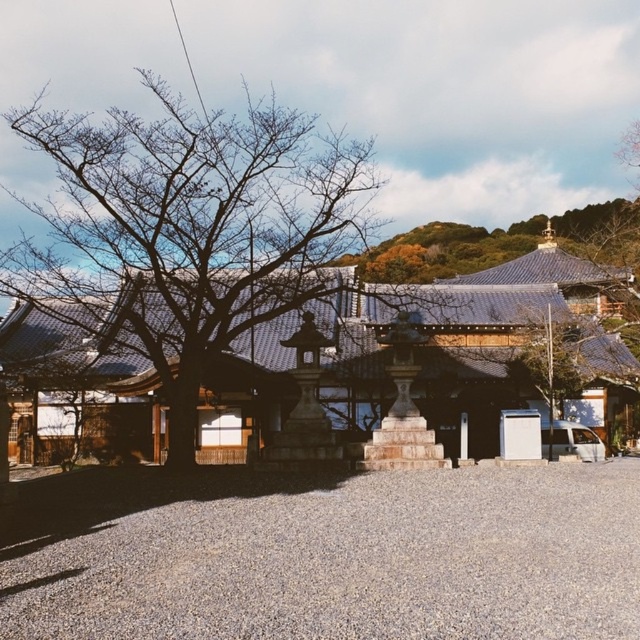
Question: Which point is farther to the camera?

Choices:
 (A) bare wood tree at left
 (B) gray gravel at center

Answer: (A)

Question: Does gray gravel at center appear over bare wood tree at left?

Choices:
 (A) no
 (B) yes

Answer: (A)

Question: Is gray gravel at center positioned behind bare wood tree at left?

Choices:
 (A) yes
 (B) no

Answer: (B)

Question: Which of the following is the closest to the observer?

Choices:
 (A) bare wood tree at left
 (B) gray gravel at center

Answer: (B)

Question: Is gray gravel at center wider than bare wood tree at left?

Choices:
 (A) yes
 (B) no

Answer: (B)